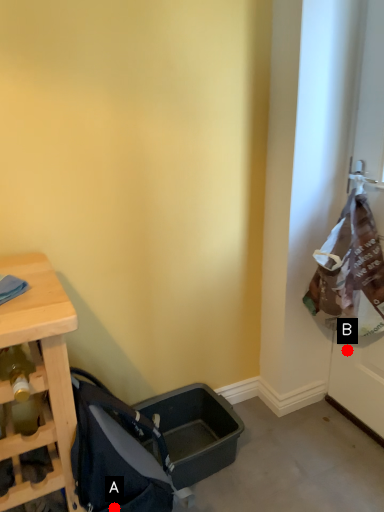
Question: Two points are circled on the image, labeled by A and B beside each circle. Which point appears closest to the camera in this image?

Choices:
 (A) A is closer
 (B) B is closer

Answer: (A)